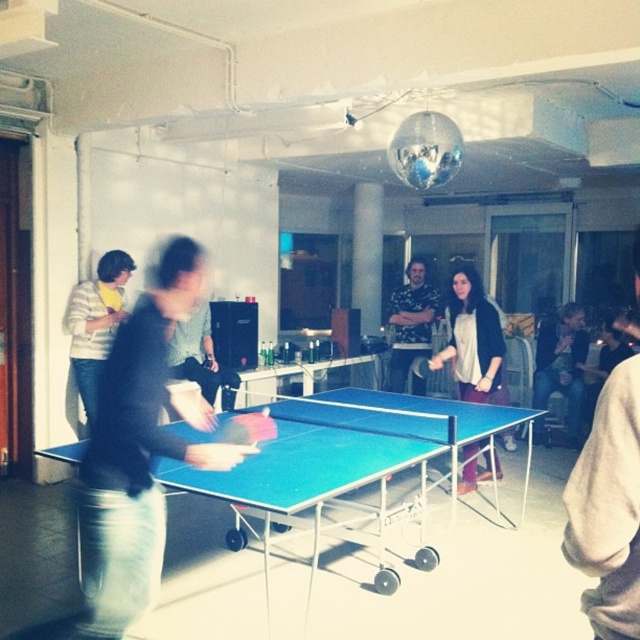
You are a photographer standing in the room and want to take a photo of the matte black shirt at center and the shiny metallic disco ball at upper center. Which object is closer to the camera based on their positions?

The matte black shirt at center is closer to the camera than the shiny metallic disco ball at upper center because it is positioned below it, indicating it is in a lower plane closer to the camera.

You are standing at the origin of the coordinate system in the room. The blue plastic table at center is located at point (346,464). If you want to walk to the blue plastic table at center, which direction should you move in?

You should move towards the point (346,464) to reach the blue plastic table at center.

You are a photographer trying to capture the table tennis match. You notice the matte black shirt at center and the shiny metallic disco ball at upper center. Which object would appear larger in your photo?

The matte black shirt at center would appear larger in the photo since it is bigger than the shiny metallic disco ball at upper center according to the description.